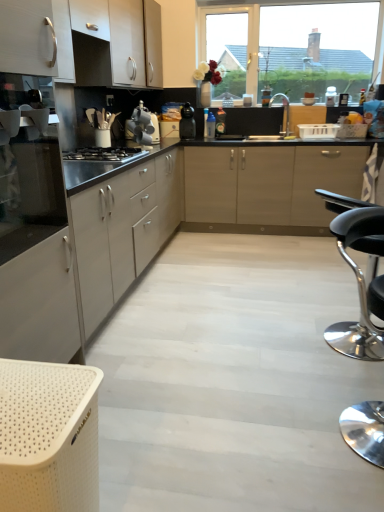
Question: Is white matte cabinet at left, the third cabinetry when ordered from top to bottom, at the right side of transparent glass window at upper center?

Choices:
 (A) no
 (B) yes

Answer: (A)

Question: Is white matte cabinet at left, which is the first cabinetry from bottom to top, turned away from transparent glass window at upper center?

Choices:
 (A) yes
 (B) no

Answer: (B)

Question: Is white matte cabinet at left, the third cabinetry when ordered from top to bottom, not within transparent glass window at upper center?

Choices:
 (A) no
 (B) yes

Answer: (B)

Question: Is there a large distance between white matte cabinet at left, which is the first cabinetry from bottom to top, and transparent glass window at upper center?

Choices:
 (A) yes
 (B) no

Answer: (A)

Question: Is white matte cabinet at left, which is the first cabinetry from bottom to top, closer to the viewer compared to transparent glass window at upper center?

Choices:
 (A) yes
 (B) no

Answer: (A)

Question: Does white matte cabinet at left, which is the first cabinetry from bottom to top, have a lesser width compared to transparent glass window at upper center?

Choices:
 (A) no
 (B) yes

Answer: (A)

Question: Can you confirm if black matte coffee maker at center, the second kitchen appliance when ordered from front to back, is shorter than black leather stool at lower right?

Choices:
 (A) no
 (B) yes

Answer: (B)

Question: Is black matte coffee maker at center, the second kitchen appliance when ordered from front to back, outside of black leather stool at lower right?

Choices:
 (A) no
 (B) yes

Answer: (B)

Question: Would you consider black matte coffee maker at center, the second kitchen appliance when ordered from front to back, to be distant from black leather stool at lower right?

Choices:
 (A) no
 (B) yes

Answer: (B)

Question: Is black matte coffee maker at center, placed as the first kitchen appliance when sorted from back to front, wider than black leather stool at lower right?

Choices:
 (A) yes
 (B) no

Answer: (B)

Question: Is black matte coffee maker at center, which appears as the first kitchen appliance when viewed from the right, in front of black leather stool at lower right?

Choices:
 (A) yes
 (B) no

Answer: (B)

Question: Could you tell me if black matte coffee maker at center, the second kitchen appliance when ordered from front to back, is facing black leather stool at lower right?

Choices:
 (A) yes
 (B) no

Answer: (B)

Question: Would you say black matte gas stove at center is outside satin silver kettle at center, the 2th kitchen appliance viewed from the right?

Choices:
 (A) yes
 (B) no

Answer: (A)